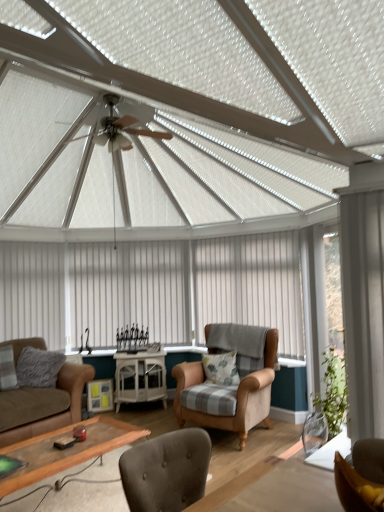
Question: Is wooden glass coffee table at lower center inside or outside of brown leather couch at lower left?

Choices:
 (A) inside
 (B) outside

Answer: (B)

Question: Relative to brown leather couch at lower left, is wooden glass coffee table at lower center in front or behind?

Choices:
 (A) front
 (B) behind

Answer: (A)

Question: Which object is the farthest from the brown leather couch at lower left?

Choices:
 (A) wooden glass coffee table at lower center
 (B) gray fluffy pillow at lower left, placed as the second pillow when sorted from right to left
 (C) white textured curtain at center, arranged as the third curtain when viewed from the right
 (D) fluffy gray pillow at center, the first pillow positioned from the right
 (E) white glossy cabinet at center

Answer: (D)

Question: Estimate the real-world distances between objects in this image. Which object is farther from the brown fabric chair at lower right, which is the 2th chair from bottom to top?

Choices:
 (A) white textured curtain at center, the first curtain viewed from the back
 (B) tan velvet armchair at center, the 2th chair when ordered from top to bottom
 (C) brown leather couch at lower left
 (D) white fabric curtain at center, the second curtain when ordered from front to back
 (E) white sheer curtain at right, which is the 4th curtain from back to front

Answer: (A)